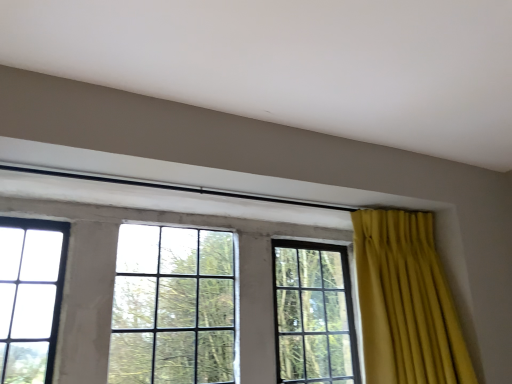
What is the approximate height of clear glass window at center?

67.35 centimeters.

Locate an element on the screen. This screenshot has height=384, width=512. clear glass window at center is located at coordinates (114, 276).

What do you see at coordinates (114, 276) in the screenshot? I see `clear glass window at center` at bounding box center [114, 276].

Find the location of a particular element. The width and height of the screenshot is (512, 384). clear glass window at center is located at coordinates point(114,276).